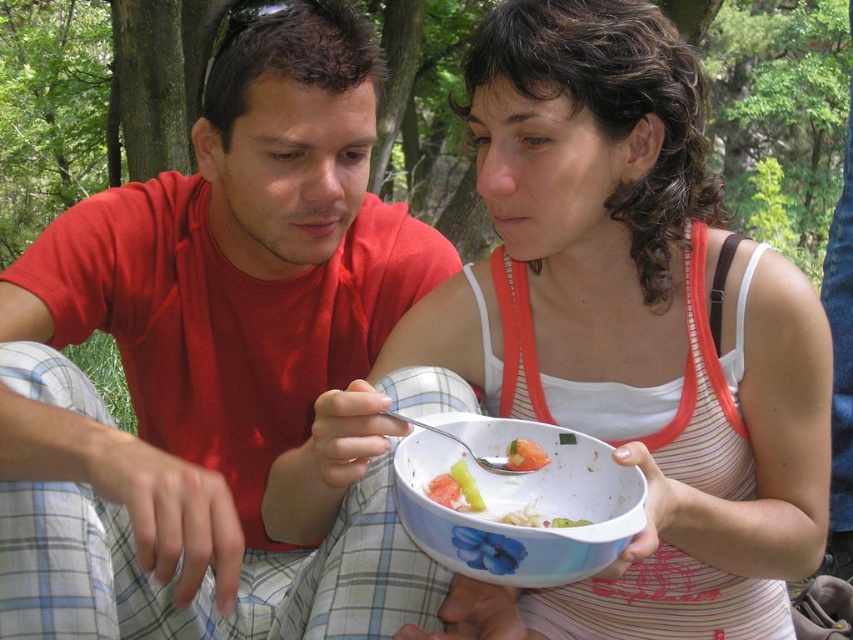
Question: Is the position of white fabric tank top at center more distant than that of white glossy bowl at center?

Choices:
 (A) no
 (B) yes

Answer: (B)

Question: Which of these objects is positioned farthest from the white glossy bowl at center?

Choices:
 (A) white fabric tank top at center
 (B) green leafy vegetable at bowl center
 (C) matte red shirt at center

Answer: (C)

Question: Estimate the real-world distances between objects in this image. Which object is closer to the white fabric tank top at center?

Choices:
 (A) green leafy vegetable at bowl center
 (B) matte red shirt at center

Answer: (A)

Question: Among these objects, which one is nearest to the camera?

Choices:
 (A) white fabric tank top at center
 (B) green leafy vegetable at bowl center
 (C) matte red shirt at center

Answer: (A)

Question: Is matte red shirt at center smaller than white fabric tank top at center?

Choices:
 (A) yes
 (B) no

Answer: (B)

Question: Does white fabric tank top at center have a greater width compared to white glossy bowl at center?

Choices:
 (A) no
 (B) yes

Answer: (B)